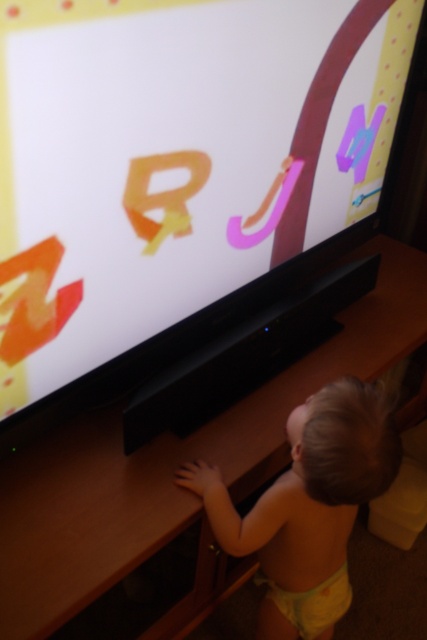
The child is trying to reach both the purple matte letter m at upper right and the pink matte letter j at center on the TV screen. Which letter is taller?

The pink matte letter j at center is taller than the purple matte letter m at upper right.

You are a photographer trying to capture a clear shot of the matte orange letter z at left and the blonde hair toddler at lower center. However, the toddler is blocking the view of the letter. Can you adjust your position to see both objects without moving either of them?

The matte orange letter z at left is behind the blonde hair toddler at lower center, so you would need to position yourself where the toddler is not obstructing the view of the letter. Moving to the side or slightly behind the toddler might allow you to see both the toddler and the letter simultaneously.

You are a photographer trying to capture the toddler without any obstructions. Based on the scene, can you position yourself so that the blonde hair toddler at lower center is visible without the pink matte letter j at center blocking the view?

The blonde hair toddler at lower center is in front of the pink matte letter j at center, so the toddler is already blocking the letter. To capture the toddler without obstruction, you would need to position yourself where the camera is currently positioned, as the toddler is the foreground object and the letter is behind them.